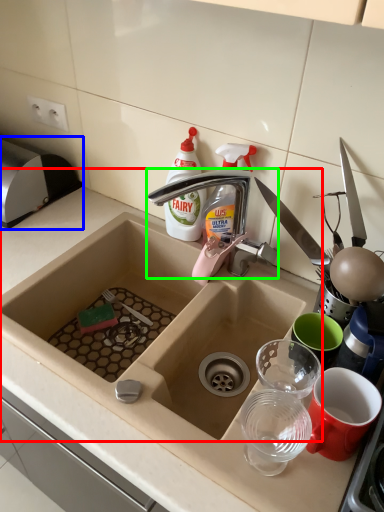
Question: Which object is the farthest from sink (highlighted by a red box)? Choose among these: appliance (highlighted by a blue box) or tap (highlighted by a green box).

Choices:
 (A) appliance
 (B) tap

Answer: (A)